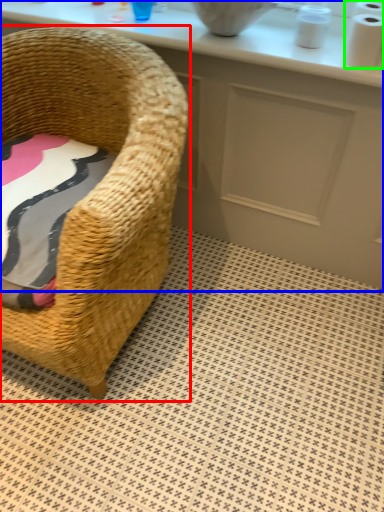
Question: Estimate the real-world distances between objects in this image. Which object is closer to chair (highlighted by a red box), counter (highlighted by a blue box) or toilet paper (highlighted by a green box)?

Choices:
 (A) counter
 (B) toilet paper

Answer: (A)